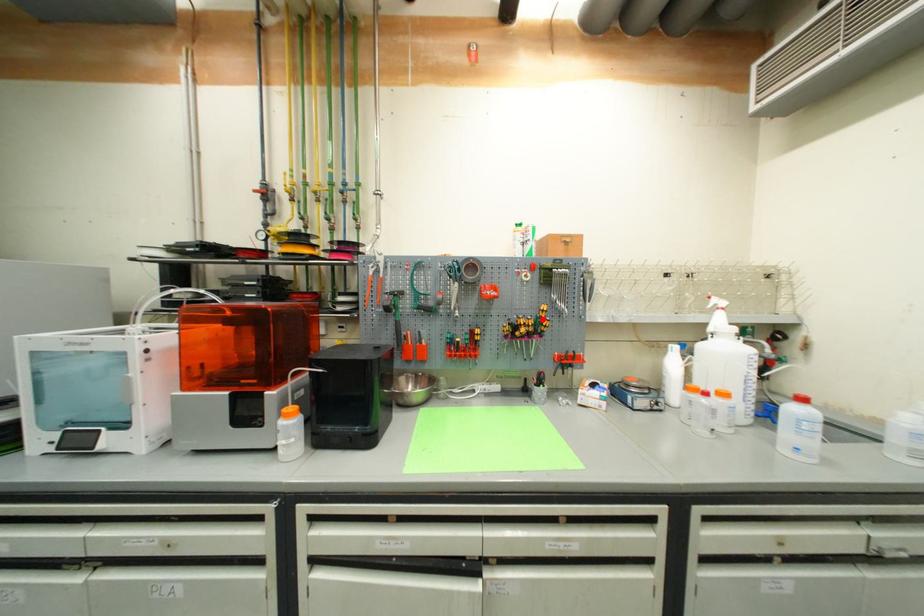
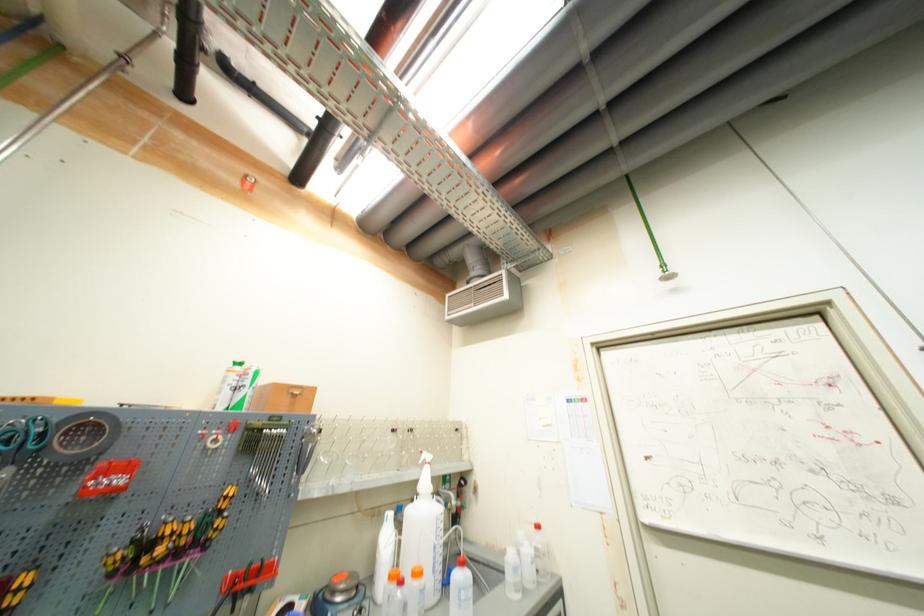
Find the pixel in the second image that matches the highlighted location in the first image.

(211, 517)